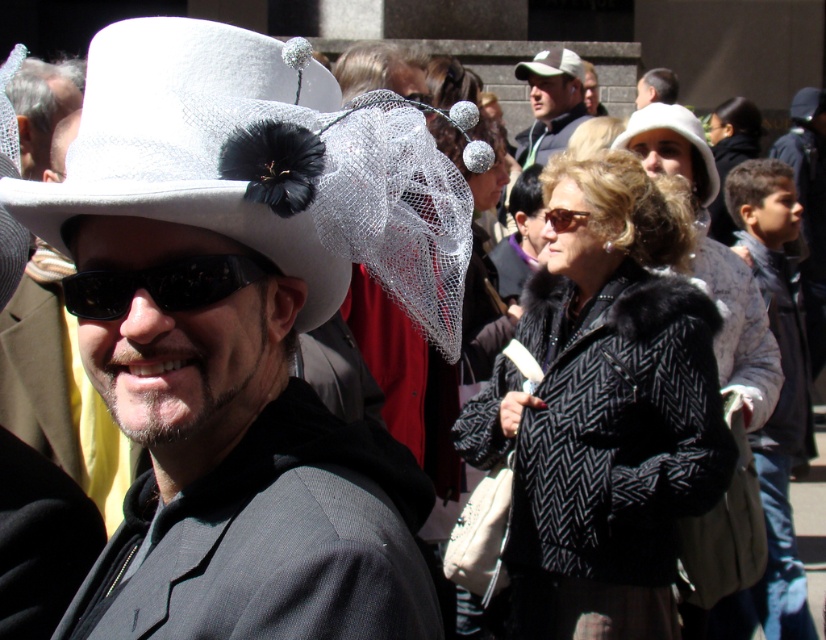
You are a photographer at the event and want to capture both the black herringbone coat at center and the white lace hat at center in a single photo. Since your camera has limited zoom, you need to stand at a distance where both objects can fit in the frame. Which object should you position closer to the edge of the frame to ensure both are visible?

You should position the black herringbone coat at center closer to the edge of the frame because it is larger than the white lace hat at center, so it will take up more space in the photo.

You are standing at the origin point of the coordinate system in the image. You want to locate the black herringbone coat at center. In which direction should you move relative to your current position?

Since the black herringbone coat at center is located at coordinate point 0.642 on the x axis and 0.734 on the y axis, you should move northeast to reach it from the origin point.